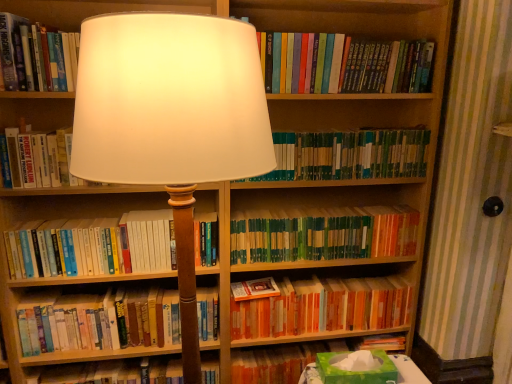
Question: Is matte white lampshade at center far from green matte bookshelf at center, the fifth book when ordered from top to bottom?

Choices:
 (A) no
 (B) yes

Answer: (A)

Question: Is matte white lampshade at center facing towards green matte bookshelf at center, the fifth book when ordered from top to bottom?

Choices:
 (A) yes
 (B) no

Answer: (B)

Question: Does matte white lampshade at center lie behind green matte bookshelf at center, placed as the 4th book when sorted from bottom to top?

Choices:
 (A) no
 (B) yes

Answer: (A)

Question: Is matte white lampshade at center not within green matte bookshelf at center, the fifth book when ordered from top to bottom?

Choices:
 (A) yes
 (B) no

Answer: (A)

Question: Can you confirm if matte white lampshade at center is shorter than green matte bookshelf at center, placed as the 4th book when sorted from bottom to top?

Choices:
 (A) no
 (B) yes

Answer: (A)

Question: Is matte white lampshade at center in front of or behind hardcover books at left, which is counted as the 6th book, starting from the top, in the image?

Choices:
 (A) behind
 (B) front

Answer: (B)

Question: From a real-world perspective, is matte white lampshade at center physically located above or below hardcover books at left, which is counted as the 6th book, starting from the top?

Choices:
 (A) above
 (B) below

Answer: (A)

Question: Does point (253, 132) appear closer or farther from the camera than point (15, 241)?

Choices:
 (A) farther
 (B) closer

Answer: (B)

Question: In terms of width, does matte white lampshade at center look wider or thinner when compared to hardcover books at left, which is counted as the 6th book, starting from the top?

Choices:
 (A) wide
 (B) thin

Answer: (A)

Question: Is hardcover books at upper center, acting as the 8th book starting from the bottom, taller or shorter than matte white lampshade at center?

Choices:
 (A) tall
 (B) short

Answer: (B)

Question: Considering the positions of point (355, 82) and point (190, 193), is point (355, 82) closer or farther from the camera than point (190, 193)?

Choices:
 (A) farther
 (B) closer

Answer: (A)

Question: From the image's perspective, relative to matte white lampshade at center, is hardcover books at upper center, acting as the 8th book starting from the bottom, above or below?

Choices:
 (A) below
 (B) above

Answer: (B)

Question: From a real-world perspective, is hardcover books at upper center, acting as the 8th book starting from the bottom, positioned above or below matte white lampshade at center?

Choices:
 (A) above
 (B) below

Answer: (A)

Question: Is point (251, 228) positioned closer to the camera than point (132, 269)?

Choices:
 (A) farther
 (B) closer

Answer: (A)

Question: Would you say green matte bookshelf at center, placed as the 4th book when sorted from bottom to top, is to the left or to the right of hardcover books at left, which is counted as the 6th book, starting from the top, in the picture?

Choices:
 (A) left
 (B) right

Answer: (B)